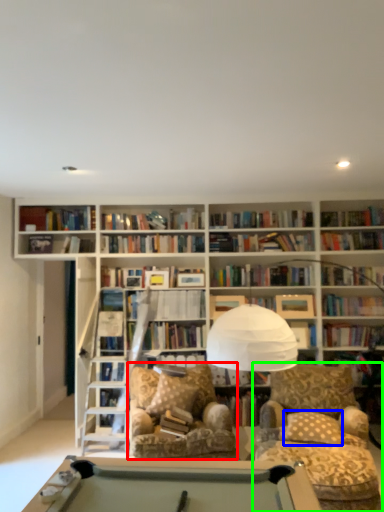
Question: Considering the real-world distances, which object is farthest from swivel chair (highlighted by a red box)? pillow (highlighted by a blue box) or chair (highlighted by a green box)?

Choices:
 (A) pillow
 (B) chair

Answer: (A)